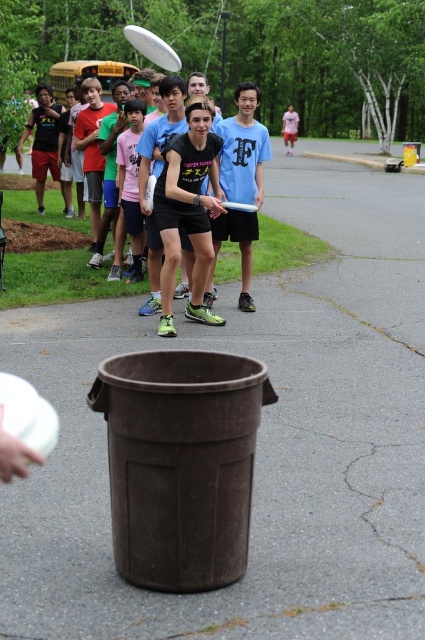
Question: Does matte black t-shirt at center appear on the right side of pink cotton shirt at center?

Choices:
 (A) no
 (B) yes

Answer: (A)

Question: Can you confirm if matte black t-shirt at center is positioned to the right of pink cotton shirt at center?

Choices:
 (A) yes
 (B) no

Answer: (B)

Question: Which of the following is the farthest from the observer?

Choices:
 (A) matte black t-shirt at center
 (B) yellow metallic school bus at upper left

Answer: (B)

Question: Which object is closer to the camera taking this photo?

Choices:
 (A) matte black t-shirt at center
 (B) pink cotton shirt at center

Answer: (A)

Question: Which object appears farthest from the camera in this image?

Choices:
 (A) yellow metallic school bus at upper left
 (B) pink cotton shirt at center

Answer: (B)

Question: Can you confirm if matte black t-shirt at center is wider than yellow metallic school bus at upper left?

Choices:
 (A) no
 (B) yes

Answer: (A)